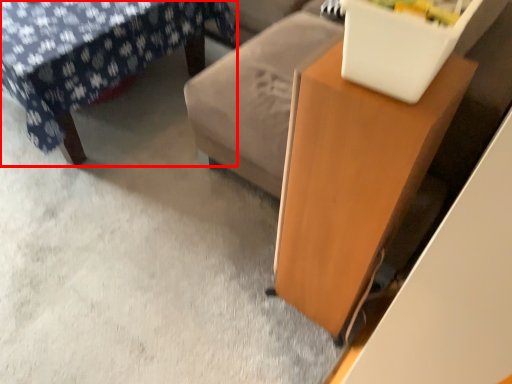
Question: Observing the image, what is the correct spatial positioning of furniture (annotated by the red box) in reference to table?

Choices:
 (A) right
 (B) left

Answer: (B)